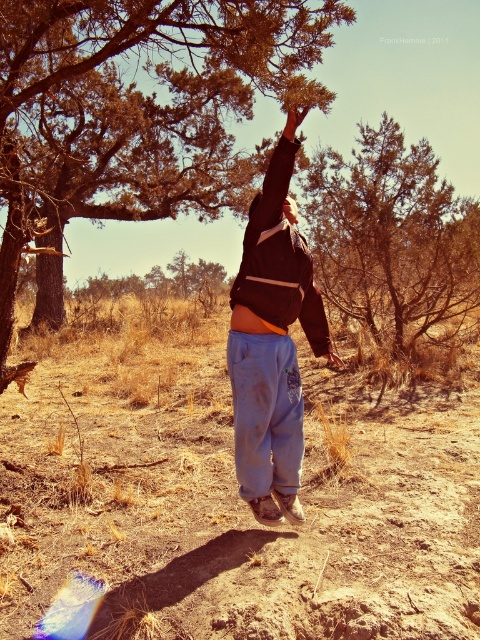
You are standing at the origin of a coordinate system in this scene. You see a point labeled as point (136,108). Which object does this point belong to?

The point (136,108) is on green leafy tree at upper center.

You are standing at the point marked by the coordinates point [136,108] in the image. Looking around, you see the green leafy tree at upper center. Which direction should you face to look directly at the green leafy tree at upper center?

You should face north because the green leafy tree at upper center is located at the point marked by the coordinates point [136,108], which is in the upper center direction from your current position.